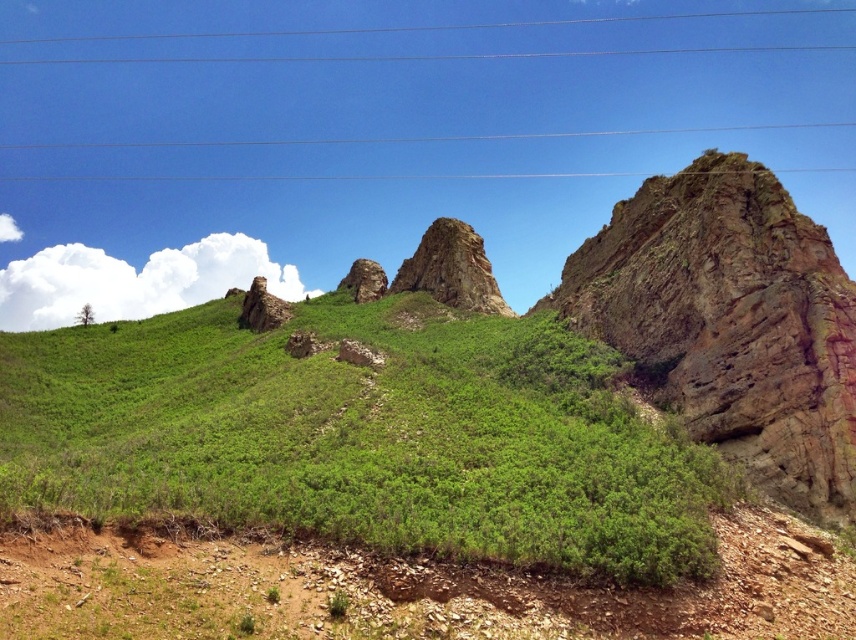
Question: Which point is closer to the camera taking this photo?

Choices:
 (A) pyautogui.click(x=554, y=20)
 (B) pyautogui.click(x=467, y=323)

Answer: (B)

Question: Can you confirm if green leafy grass at center is wider than metallic wires at upper center?

Choices:
 (A) no
 (B) yes

Answer: (A)

Question: Which of the following is the closest to the observer?

Choices:
 (A) (592, 461)
 (B) (284, 177)

Answer: (A)

Question: Does green leafy grass at center appear under rusty rock formation at center?

Choices:
 (A) no
 (B) yes

Answer: (B)

Question: Considering the real-world distances, which object is closest to the rusty rock formation at center?

Choices:
 (A) green leafy grass at center
 (B) metallic wires at upper center

Answer: (A)

Question: Considering the relative positions of metallic wires at upper center and rusty rock formation at center in the image provided, where is metallic wires at upper center located with respect to rusty rock formation at center?

Choices:
 (A) left
 (B) right

Answer: (A)